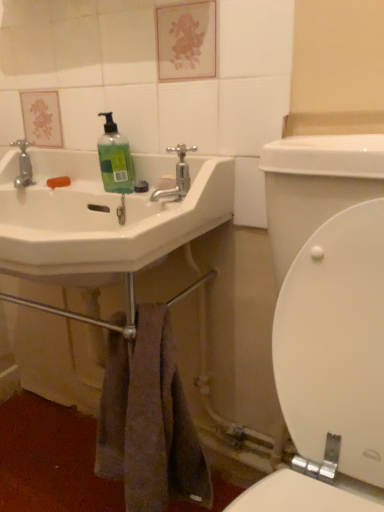
The height and width of the screenshot is (512, 384). Describe the element at coordinates (177, 176) in the screenshot. I see `polished chrome faucet at upper center` at that location.

Locate an element on the screen. The width and height of the screenshot is (384, 512). polished chrome faucet at upper center is located at coordinates (177, 176).

Does white glossy sink at left appear on the right side of polished chrome faucet at upper center?

No.

Does white glossy sink at left have a smaller size compared to polished chrome faucet at upper center?

Actually, white glossy sink at left might be larger than polished chrome faucet at upper center.

From a real-world perspective, does white glossy sink at left stand above polished chrome faucet at upper center?

Incorrect, from a real-world perspective, white glossy sink at left is lower than polished chrome faucet at upper center.

How far apart are polished chrome faucet at upper center and white glossy sink at left?

They are 7.71 inches apart.

Does polished chrome faucet at upper center come behind white glossy sink at left?

Yes, the depth of polished chrome faucet at upper center is greater than that of white glossy sink at left.

Is polished chrome faucet at upper center positioned with its back to white glossy sink at left?

That's right, polished chrome faucet at upper center is facing away from white glossy sink at left.

Would you consider green matte liquid soap at upper left to be distant from white glossy toilet at lower right?

green matte liquid soap at upper left is near white glossy toilet at lower right, not far away.

Considering their positions, is green matte liquid soap at upper left located in front of or behind white glossy toilet at lower right?

green matte liquid soap at upper left is behind white glossy toilet at lower right.

Does green matte liquid soap at upper left have a lesser height compared to white glossy toilet at lower right?

Correct, green matte liquid soap at upper left is not as tall as white glossy toilet at lower right.

Which object is thinner, green matte liquid soap at upper left or white glossy toilet at lower right?

white glossy toilet at lower right is thinner.

Based on the photo, is white glossy sink at left oriented away from white glossy toilet at lower right?

white glossy sink at left is not turned away from white glossy toilet at lower right.

Locate an element on the screen. This screenshot has height=512, width=384. sink that appears above the white glossy toilet at lower right (from the image's perspective) is located at coordinates (100, 219).

What's the angular difference between white glossy sink at left and white glossy toilet at lower right's facing directions?

white glossy sink at left and white glossy toilet at lower right are facing 0.00146 degrees away from each other.

Is white glossy toilet at lower right a part of white glossy sink at left?

No, white glossy toilet at lower right is not inside white glossy sink at left.

Is point (186, 170) farther from viewer compared to point (107, 150)?

No, (186, 170) is in front of (107, 150).

Can you confirm if polished chrome faucet at upper center is shorter than green matte liquid soap at upper left?

Correct, polished chrome faucet at upper center is not as tall as green matte liquid soap at upper left.

Would you consider polished chrome faucet at upper center to be distant from green matte liquid soap at upper left?

No, polished chrome faucet at upper center is not far away from green matte liquid soap at upper left.

Is polished chrome faucet at upper center looking in the opposite direction of green matte liquid soap at upper left?

That's not correct — polished chrome faucet at upper center is not looking away from green matte liquid soap at upper left.

Does point (126, 180) come closer to viewer compared to point (185, 203)?

No, it is not.

From the image's perspective, is green matte liquid soap at upper left below white glossy sink at left?

Actually, green matte liquid soap at upper left appears above white glossy sink at left in the image.

Is green matte liquid soap at upper left next to white glossy sink at left?

No, green matte liquid soap at upper left is not in contact with white glossy sink at left.

From the picture: From a real-world perspective, which is physically below, green matte liquid soap at upper left or white glossy sink at left?

white glossy sink at left.

From the image's perspective, is white glossy sink at left positioned above or below green matte liquid soap at upper left?

Clearly, from the image's perspective, white glossy sink at left is below green matte liquid soap at upper left.

Considering the relative positions of white glossy sink at left and green matte liquid soap at upper left in the image provided, is white glossy sink at left behind green matte liquid soap at upper left?

That is False.

Does point (3, 255) lie in front of point (103, 115)?

That is True.

This screenshot has width=384, height=512. I want to click on sink that appears below the polished chrome faucet at upper center (from a real-world perspective), so click(100, 219).

Find the location of `tap above the white glossy sink at left (from a real-world perspective)`. tap above the white glossy sink at left (from a real-world perspective) is located at coordinates (177, 176).

Based on their spatial positions, is white glossy sink at left or brown textured towel at lower center closer to green matte liquid soap at upper left?

white glossy sink at left.

Looking at the image, which one is located further to polished chrome faucet at upper center, green matte liquid soap at upper left or white glossy sink at left?

white glossy sink at left lies further to polished chrome faucet at upper center than the other object.

Which object lies further to the anchor point white glossy sink at left, brown textured towel at lower center or polished chrome faucet at upper center?

brown textured towel at lower center is positioned further to the anchor white glossy sink at left.

Looking at the image, which one is located closer to green matte liquid soap at upper left, polished chrome faucet at upper center or white glossy toilet at lower right?

Among the two, polished chrome faucet at upper center is located nearer to green matte liquid soap at upper left.

Based on their spatial positions, is white glossy toilet at lower right or brown textured towel at lower center further from green matte liquid soap at upper left?

white glossy toilet at lower right.

Which object lies further to the anchor point white glossy sink at left, polished chrome faucet at upper center or brown textured towel at lower center?

The object further to white glossy sink at left is brown textured towel at lower center.

Looking at the image, which one is located closer to polished chrome faucet at upper center, white glossy toilet at lower right or brown textured towel at lower center?

white glossy toilet at lower right is positioned closer to the anchor polished chrome faucet at upper center.

Estimate the real-world distances between objects in this image. Which object is further from green matte liquid soap at upper left, polished chrome faucet at upper center or white glossy sink at left?

white glossy sink at left lies further to green matte liquid soap at upper left than the other object.

The height and width of the screenshot is (512, 384). In order to click on sink between green matte liquid soap at upper left and white glossy toilet at lower right from top to bottom in this screenshot , I will do `click(100, 219)`.

Where is `tap that lies between green matte liquid soap at upper left and brown textured towel at lower center from top to bottom`? The image size is (384, 512). tap that lies between green matte liquid soap at upper left and brown textured towel at lower center from top to bottom is located at coordinates (177, 176).

At what (x,y) coordinates should I click in order to perform the action: click on toilet between polished chrome faucet at upper center and brown textured towel at lower center from top to bottom. Please return your answer as a coordinate pair (x, y). The image size is (384, 512). Looking at the image, I should click on (335, 342).

Locate an element on the screen. tap between white glossy sink at left and white glossy toilet at lower right in the horizontal direction is located at coordinates (177, 176).